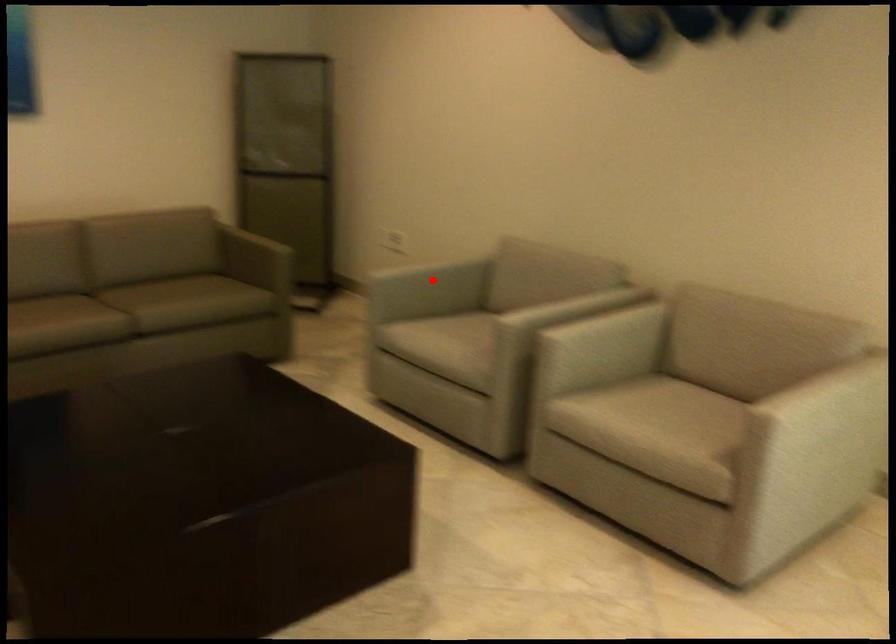
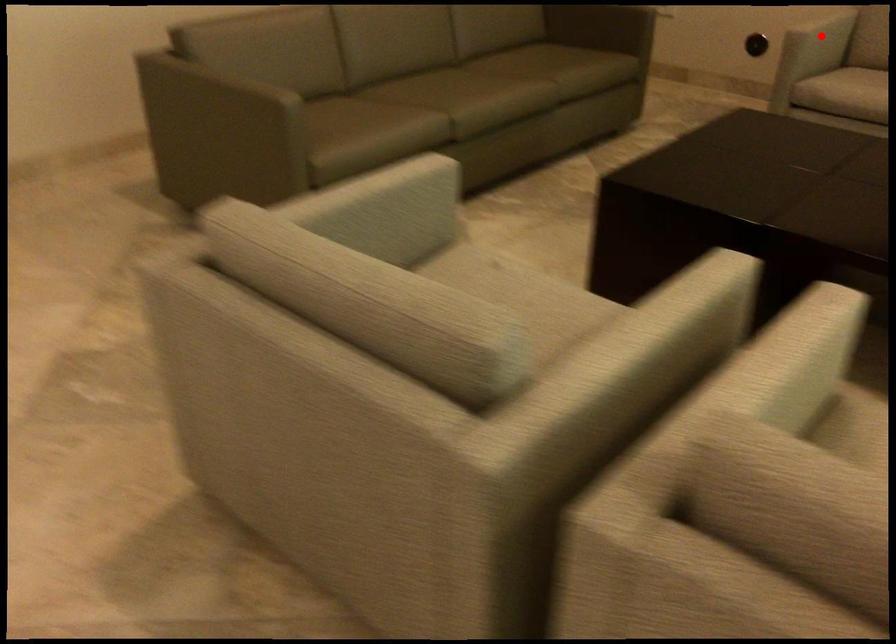
I am providing you with two images of the same scene from different viewpoints. A red point is marked on the first image and another point is marked on the second image. Does the point marked in image1 correspond to the same location as the one in image2?

Yes